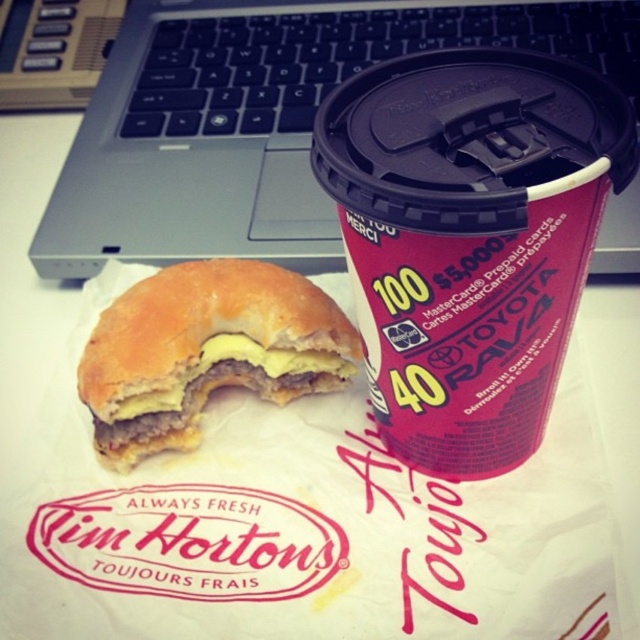
Between pink paper cup at upper center and golden-brown breaded patty at center, which one is positioned higher?

pink paper cup at upper center

Between point (506, 88) and point (173, 374), which one is positioned behind?

The point (173, 374) is more distant.

You are a GUI agent. You are given a task and a screenshot of the screen. Output one action in this format:
    pyautogui.click(x=<x>, y=<y>)
    Task: Click on the pink paper cup at upper center
    This screenshot has height=640, width=640.
    Given the screenshot: What is the action you would take?
    pyautogui.click(x=468, y=237)

Is silver metallic laptop at upper center to the right of golden-brown breaded patty at center from the viewer's perspective?

Indeed, silver metallic laptop at upper center is positioned on the right side of golden-brown breaded patty at center.

This screenshot has height=640, width=640. I want to click on silver metallic laptop at upper center, so click(260, 118).

Is point (211, 246) positioned after point (301, 321)?

Yes.

You are a GUI agent. You are given a task and a screenshot of the screen. Output one action in this format:
    pyautogui.click(x=<x>, y=<y>)
    Task: Click on the silver metallic laptop at upper center
    The image size is (640, 640).
    Given the screenshot: What is the action you would take?
    pyautogui.click(x=260, y=118)

Between pink paper cup at upper center and silver metallic laptop at upper center, which one appears on the right side from the viewer's perspective?

Positioned to the right is pink paper cup at upper center.

Is pink paper cup at upper center to the right of silver metallic laptop at upper center from the viewer's perspective?

Yes, pink paper cup at upper center is to the right of silver metallic laptop at upper center.

Measure the distance between point (556, 145) and camera.

Point (556, 145) and camera are 19.53 inches apart.

Identify the location of pink paper cup at upper center. (x=468, y=237).